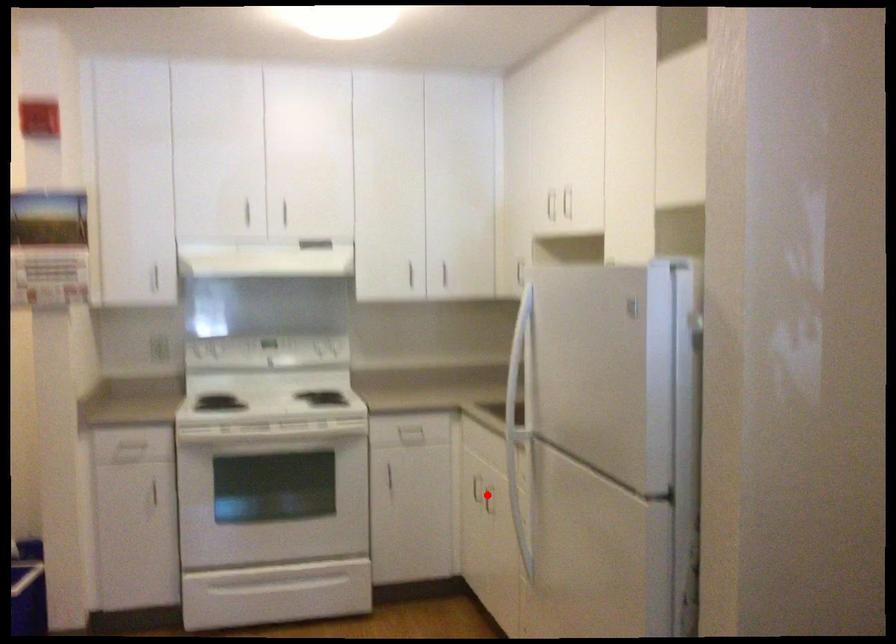
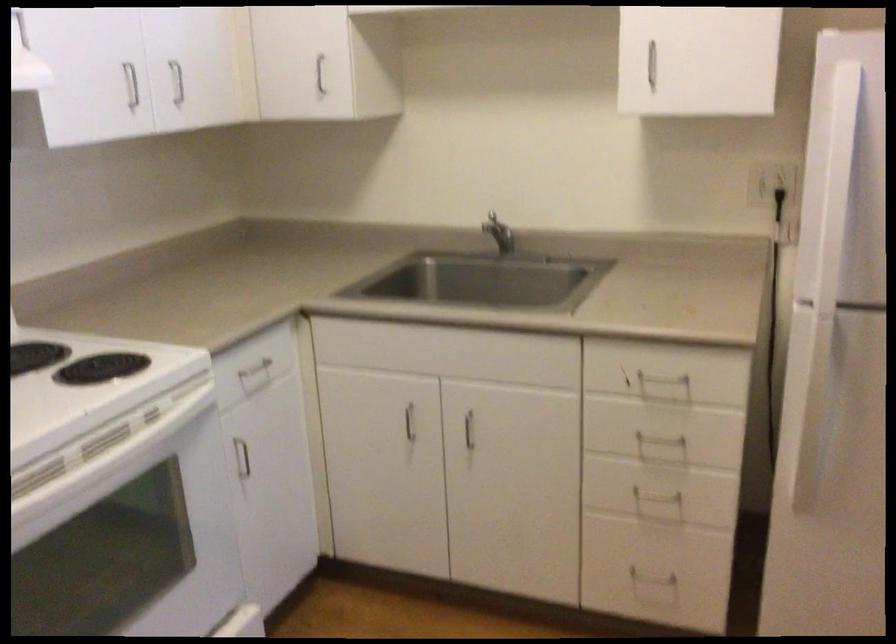
Question: I am providing you with two images of the same scene from different viewpoints. In image1, a red point is highlighted. Considering the same 3D point in image2, which of the following is correct?

Choices:
 (A) It is closer
 (B) It is farther

Answer: (A)